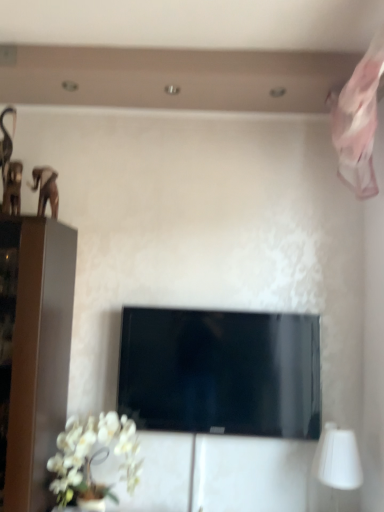
What do you see at coordinates (337, 461) in the screenshot? I see `white matte table lamp at lower right` at bounding box center [337, 461].

This screenshot has width=384, height=512. What do you see at coordinates (220, 372) in the screenshot?
I see `black glossy tv at center` at bounding box center [220, 372].

At what (x,y) coordinates should I click in order to perform the action: click on white matte table lamp at lower right. Please return your answer as a coordinate pair (x, y). Looking at the image, I should click on (337, 461).

Which is less distant, (x=57, y=460) or (x=132, y=410)?

The point (x=57, y=460) is in front.

Is white matte orchid at lower left in front of black glossy tv at center?

Yes, it is in front of black glossy tv at center.

Can you confirm if white matte orchid at lower left is smaller than black glossy tv at center?

Yes, white matte orchid at lower left is smaller than black glossy tv at center.

Is white matte table lamp at lower right taller than white matte orchid at lower left?

Incorrect, the height of white matte table lamp at lower right is not larger of that of white matte orchid at lower left.

Considering the sizes of white matte table lamp at lower right and white matte orchid at lower left in the image, is white matte table lamp at lower right bigger or smaller than white matte orchid at lower left?

Clearly, white matte table lamp at lower right is smaller in size than white matte orchid at lower left.

Does white matte table lamp at lower right have a greater width compared to white matte orchid at lower left?

No, white matte table lamp at lower right is not wider than white matte orchid at lower left.

From the image's perspective, is white matte table lamp at lower right located above white matte orchid at lower left?

No, from the image's perspective, white matte table lamp at lower right is not on top of white matte orchid at lower left.

Consider the image. Is white matte orchid at lower left directly adjacent to white matte table lamp at lower right?

white matte orchid at lower left and white matte table lamp at lower right are not in contact.

Looking at the image, does white matte orchid at lower left seem bigger or smaller compared to white matte table lamp at lower right?

white matte orchid at lower left is bigger than white matte table lamp at lower right.

Where is `flower below the white matte table lamp at lower right (from a real-world perspective)`? The height and width of the screenshot is (512, 384). flower below the white matte table lamp at lower right (from a real-world perspective) is located at coordinates (93, 460).

Could you tell me if white matte orchid at lower left is facing white matte table lamp at lower right?

No, white matte orchid at lower left is not aimed at white matte table lamp at lower right.

Is black glossy tv at center next to white matte orchid at lower left?

No, black glossy tv at center is not making contact with white matte orchid at lower left.

Is point (148, 319) farther from viewer compared to point (81, 433)?

Yes.

Is black glossy tv at center turned away from white matte orchid at lower left?

No, black glossy tv at center is not facing the opposite direction of white matte orchid at lower left.

Considering the sizes of black glossy tv at center and white matte orchid at lower left in the image, is black glossy tv at center bigger or smaller than white matte orchid at lower left?

black glossy tv at center is bigger than white matte orchid at lower left.

This screenshot has width=384, height=512. Identify the location of television lying above the white matte table lamp at lower right (from the image's perspective). (220, 372).

Considering the relative sizes of white matte table lamp at lower right and black glossy tv at center in the image provided, is white matte table lamp at lower right taller than black glossy tv at center?

Incorrect, the height of white matte table lamp at lower right is not larger of that of black glossy tv at center.

Considering the positions of point (334, 507) and point (172, 377), is point (334, 507) closer or farther from the camera than point (172, 377)?

Clearly, point (334, 507) is closer to the camera than point (172, 377).

Is white matte table lamp at lower right closer to the viewer compared to black glossy tv at center?

Yes, the depth of white matte table lamp at lower right is less than that of black glossy tv at center.

Is black glossy tv at center not within white matte table lamp at lower right?

Absolutely, black glossy tv at center is external to white matte table lamp at lower right.

Which is in front, point (285, 366) or point (359, 463)?

The point (359, 463) is closer.

Is black glossy tv at center touching white matte table lamp at lower right?

No, black glossy tv at center is not making contact with white matte table lamp at lower right.

Is black glossy tv at center facing away from white matte table lamp at lower right?

No, black glossy tv at center's orientation is not away from white matte table lamp at lower right.

At what (x,y) coordinates should I click in order to perform the action: click on television on the right side of white matte orchid at lower left. Please return your answer as a coordinate pair (x, y). Looking at the image, I should click on (220, 372).

This screenshot has height=512, width=384. Identify the location of flower located above the white matte table lamp at lower right (from the image's perspective). (93, 460).

Estimate the real-world distances between objects in this image. Which object is closer to white matte table lamp at lower right, white matte orchid at lower left or black glossy tv at center?

black glossy tv at center is closer to white matte table lamp at lower right.

Considering their positions, is white matte orchid at lower left positioned closer to black glossy tv at center than white matte table lamp at lower right?

white matte orchid at lower left is positioned closer to the anchor black glossy tv at center.

From the image, which object appears to be nearer to white matte orchid at lower left, black glossy tv at center or white matte table lamp at lower right?

black glossy tv at center is closer to white matte orchid at lower left.

Which object lies nearer to the anchor point white matte orchid at lower left, white matte table lamp at lower right or black glossy tv at center?

Among the two, black glossy tv at center is located nearer to white matte orchid at lower left.

Considering their positions, is white matte table lamp at lower right positioned closer to black glossy tv at center than white matte orchid at lower left?

white matte orchid at lower left lies closer to black glossy tv at center than the other object.

When comparing their distances from white matte table lamp at lower right, does black glossy tv at center or white matte orchid at lower left seem further?

Based on the image, white matte orchid at lower left appears to be further to white matte table lamp at lower right.

Identify the location of television between white matte orchid at lower left and white matte table lamp at lower right in the horizontal direction. (220, 372).